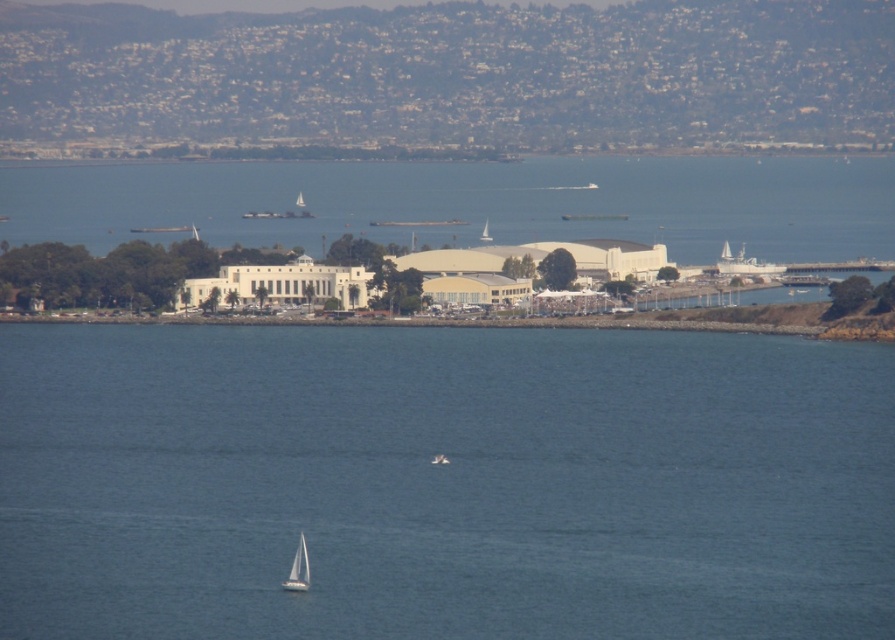
This screenshot has width=895, height=640. Identify the location of blue water at center. (442, 483).

Does blue water at center appear under white matte sailboat at lower center?

No, blue water at center is not below white matte sailboat at lower center.

Describe the element at coordinates (442, 483) in the screenshot. The image size is (895, 640). I see `blue water at center` at that location.

Identify the location of blue water at center. The image size is (895, 640). (442, 483).

Is blue water at center wider than white matte sailboat at center?

Indeed, blue water at center has a greater width compared to white matte sailboat at center.

Which of these two, blue water at center or white matte sailboat at center, stands taller?

Standing taller between the two is blue water at center.

Identify the location of blue water at center. The height and width of the screenshot is (640, 895). (442, 483).

The image size is (895, 640). Identify the location of blue water at center. (442, 483).

From the picture: Does white matte sailboat at lower center have a greater height compared to white matte sailboat at center?

Correct, white matte sailboat at lower center is much taller as white matte sailboat at center.

Is point (304, 540) in front of point (442, 461)?

No, (304, 540) is further to viewer.

Measure the distance between white matte sailboat at lower center and camera.

white matte sailboat at lower center is 653.95 meters from camera.

Locate an element on the screen. The image size is (895, 640). white matte sailboat at lower center is located at coordinates (297, 570).